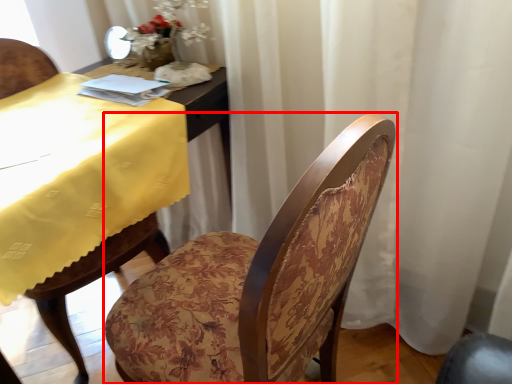
Question: Considering the relative positions of chair (annotated by the red box) and table in the image provided, where is chair (annotated by the red box) located with respect to the staircase?

Choices:
 (A) right
 (B) left

Answer: (A)